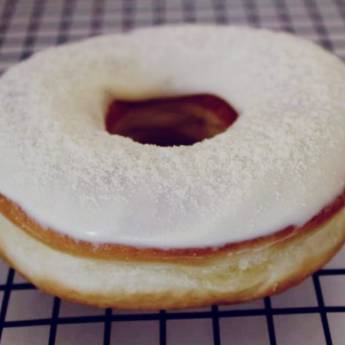
Locate an element on the screen. This screenshot has width=345, height=345. blurred background with checkered table cloth is located at coordinates (110, 10).